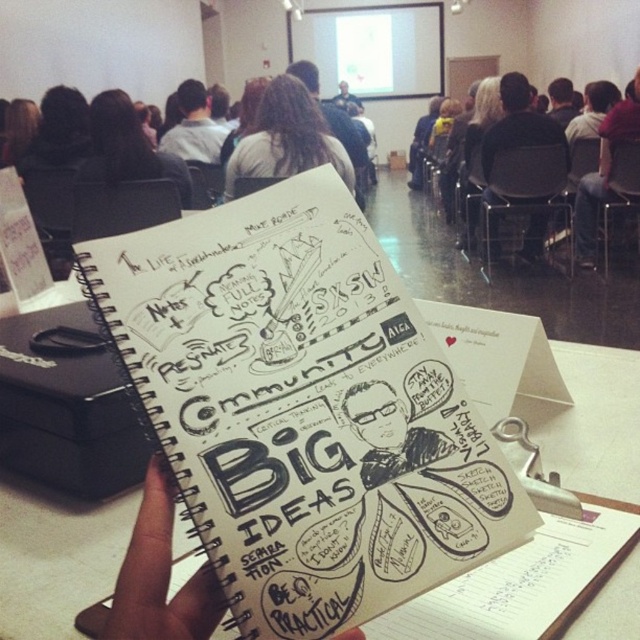
You are an attendee at the conference and you want to take a photo of the white paper notebook at center and the dark hair at center. Which object should you focus on first if you want to capture both in the same frame without moving the camera?

The white paper notebook at center has a lesser height compared to dark hair at center, so you should focus on the dark hair at center first to ensure both are in frame.

You are an attendee at a conference and you see the black paper at center and the light brown hair at upper center. Which object is located to the right of the other?

The black paper at center is positioned on the right side of light brown hair at upper center.